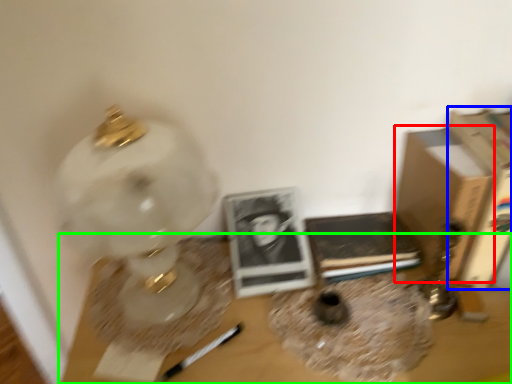
Question: Considering the real-world distances, which object is farthest from cardboard box (highlighted by a red box)? paperback book (highlighted by a blue box) or table (highlighted by a green box)?

Choices:
 (A) paperback book
 (B) table

Answer: (B)